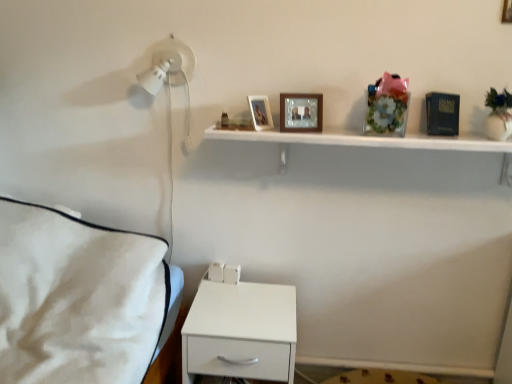
Question: Can you confirm if white matte nightstand at lower center is positioned to the left of white glossy shelf at upper center?

Choices:
 (A) no
 (B) yes

Answer: (B)

Question: Is white matte nightstand at lower center closer to the viewer compared to white glossy shelf at upper center?

Choices:
 (A) no
 (B) yes

Answer: (A)

Question: Considering the relative positions of white matte nightstand at lower center and white glossy shelf at upper center in the image provided, is white matte nightstand at lower center to the right of white glossy shelf at upper center from the viewer's perspective?

Choices:
 (A) no
 (B) yes

Answer: (A)

Question: Are white matte nightstand at lower center and white glossy shelf at upper center located far from each other?

Choices:
 (A) yes
 (B) no

Answer: (B)

Question: From a real-world perspective, is white matte nightstand at lower center beneath white glossy shelf at upper center?

Choices:
 (A) yes
 (B) no

Answer: (A)

Question: From their relative heights in the image, would you say white matte nightstand at lower center is taller or shorter than matte wooden picture frame at upper center, which appears as the third picture frame when viewed from the right?

Choices:
 (A) tall
 (B) short

Answer: (A)

Question: From a real-world perspective, is white matte nightstand at lower center positioned above or below matte wooden picture frame at upper center, positioned as the 2th picture frame in bottom-to-top order?

Choices:
 (A) above
 (B) below

Answer: (B)

Question: Is point (204, 291) positioned closer to the camera than point (268, 105)?

Choices:
 (A) farther
 (B) closer

Answer: (A)

Question: Is white matte nightstand at lower center inside the boundaries of matte wooden picture frame at upper center, acting as the 1th picture frame starting from the left, or outside?

Choices:
 (A) inside
 (B) outside

Answer: (B)

Question: From a real-world perspective, is wooden picture frame at upper center, acting as the third picture frame starting from the bottom, physically located above or below white glossy shelf at upper center?

Choices:
 (A) above
 (B) below

Answer: (A)

Question: Is point (504, 11) positioned closer to the camera than point (382, 142)?

Choices:
 (A) closer
 (B) farther

Answer: (B)

Question: In the image, is wooden picture frame at upper center, acting as the third picture frame starting from the bottom, positioned in front of or behind white glossy shelf at upper center?

Choices:
 (A) behind
 (B) front

Answer: (A)

Question: Is wooden picture frame at upper center, positioned as the third picture frame in left-to-right order, inside or outside of white glossy shelf at upper center?

Choices:
 (A) outside
 (B) inside

Answer: (A)

Question: Relative to white matte nightstand at lower center, is wooden picture frame at upper center, the 2th picture frame positioned from the left, in front or behind?

Choices:
 (A) behind
 (B) front

Answer: (A)

Question: Is point (297, 125) positioned closer to the camera than point (288, 319)?

Choices:
 (A) farther
 (B) closer

Answer: (B)